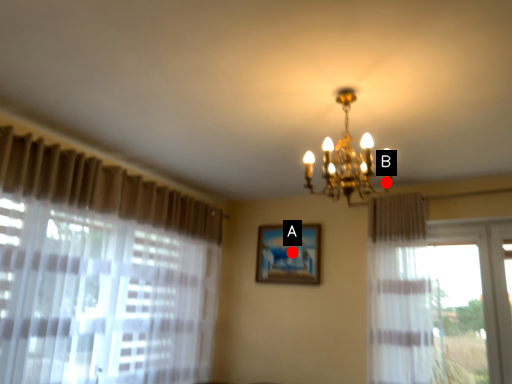
Question: Two points are circled on the image, labeled by A and B beside each circle. Which of the following is the farthest from the observer?

Choices:
 (A) A is further
 (B) B is further

Answer: (A)